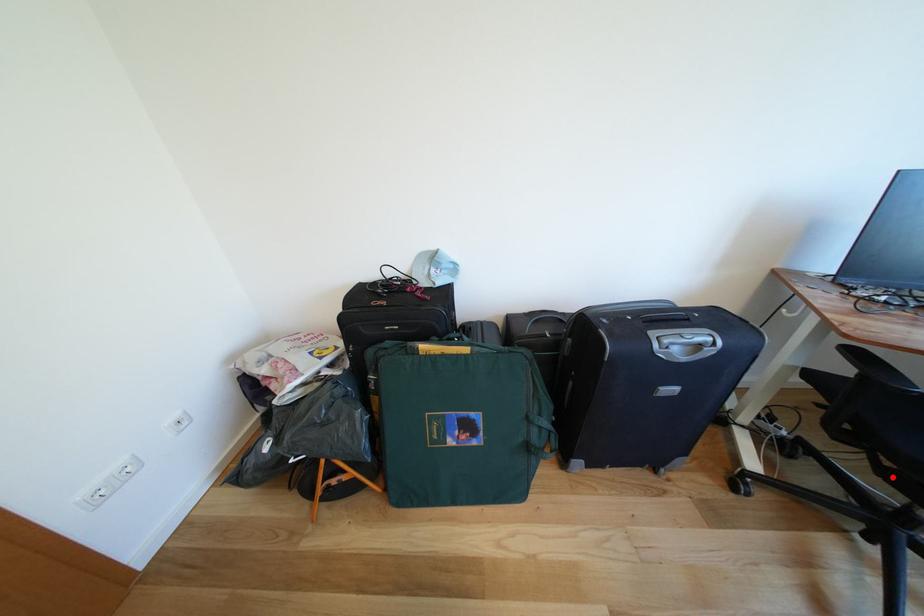
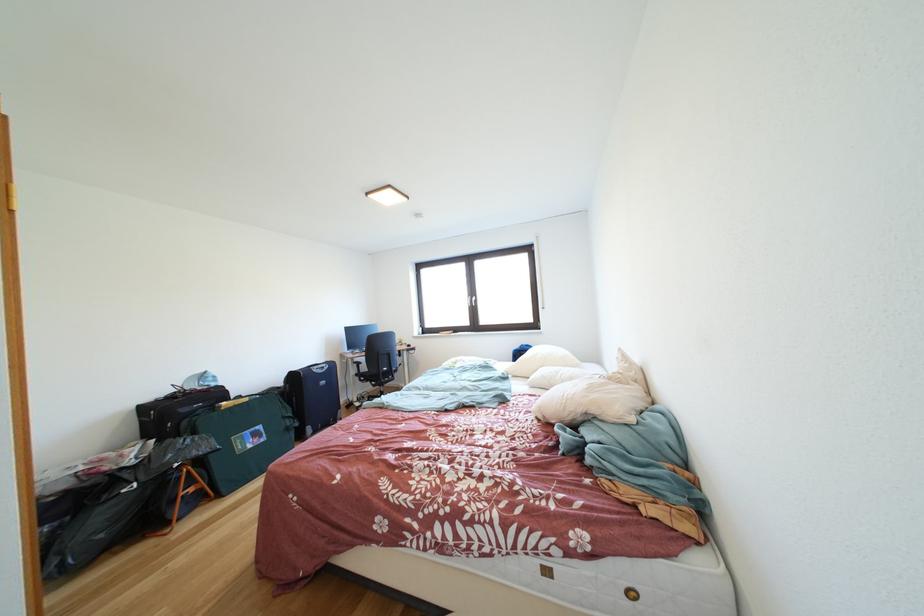
The point at the highlighted location is marked in the first image. Where is the corresponding point in the second image?

(383, 391)